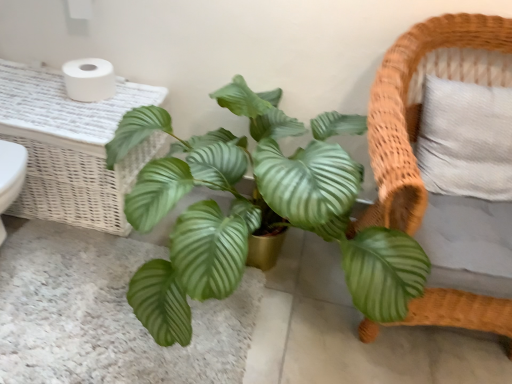
Question: Is green glossy leaf at center at the right side of white matte toilet paper at upper left?

Choices:
 (A) yes
 (B) no

Answer: (A)

Question: Is green glossy leaf at center wider than white matte toilet paper at upper left?

Choices:
 (A) no
 (B) yes

Answer: (B)

Question: Considering the relative sizes of green glossy leaf at center and white matte toilet paper at upper left in the image provided, is green glossy leaf at center taller than white matte toilet paper at upper left?

Choices:
 (A) no
 (B) yes

Answer: (A)

Question: Is white matte toilet paper at upper left located within green glossy leaf at center?

Choices:
 (A) no
 (B) yes

Answer: (A)

Question: From the image's perspective, is green glossy leaf at center beneath white matte toilet paper at upper left?

Choices:
 (A) no
 (B) yes

Answer: (B)

Question: Does green glossy leaf at center have a lesser width compared to white matte toilet paper at upper left?

Choices:
 (A) no
 (B) yes

Answer: (A)

Question: Is white matte toilet paper at upper left positioned beyond the bounds of green glossy leafy plant at center?

Choices:
 (A) no
 (B) yes

Answer: (B)

Question: Does white matte toilet paper at upper left contain green glossy leafy plant at center?

Choices:
 (A) yes
 (B) no

Answer: (B)

Question: From a real-world perspective, is white matte toilet paper at upper left on top of green glossy leafy plant at center?

Choices:
 (A) yes
 (B) no

Answer: (A)

Question: Considering the relative sizes of white matte toilet paper at upper left and green glossy leafy plant at center in the image provided, is white matte toilet paper at upper left wider than green glossy leafy plant at center?

Choices:
 (A) yes
 (B) no

Answer: (B)

Question: Is white matte toilet paper at upper left at the right side of green glossy leafy plant at center?

Choices:
 (A) yes
 (B) no

Answer: (B)

Question: Considering the relative positions of white matte toilet paper at upper left and green glossy leafy plant at center in the image provided, is white matte toilet paper at upper left to the left of green glossy leafy plant at center from the viewer's perspective?

Choices:
 (A) yes
 (B) no

Answer: (A)

Question: From a real-world perspective, does white wicker table at upper left stand above green glossy leaf at center?

Choices:
 (A) yes
 (B) no

Answer: (A)